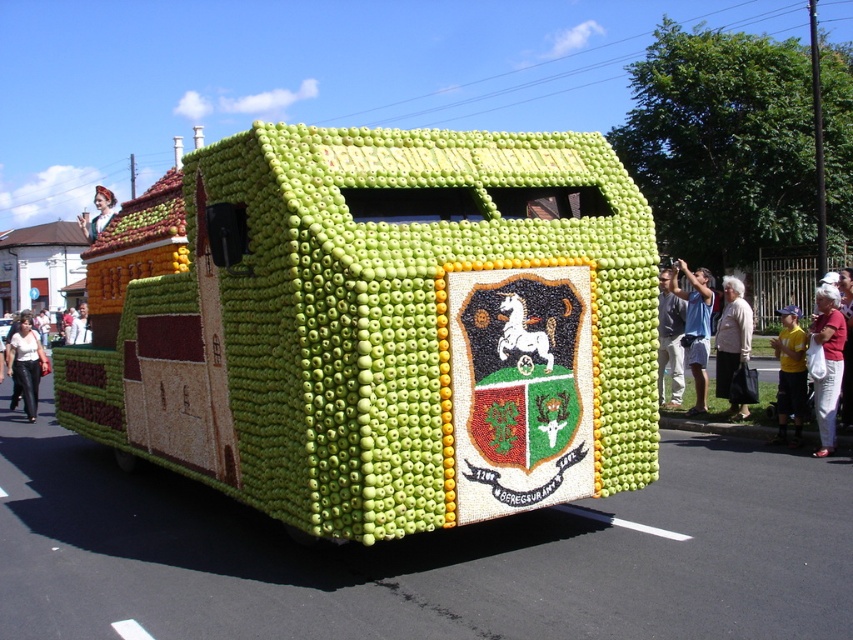
You are a fashion designer observing the float and its decorations. You notice the white leather pants at lower left and the matte white dress at upper left. Which of these two items is shorter in height?

The white leather pants at lower left has a lesser height compared to the matte white dress at upper left, so the white leather pants at lower left is shorter in height.